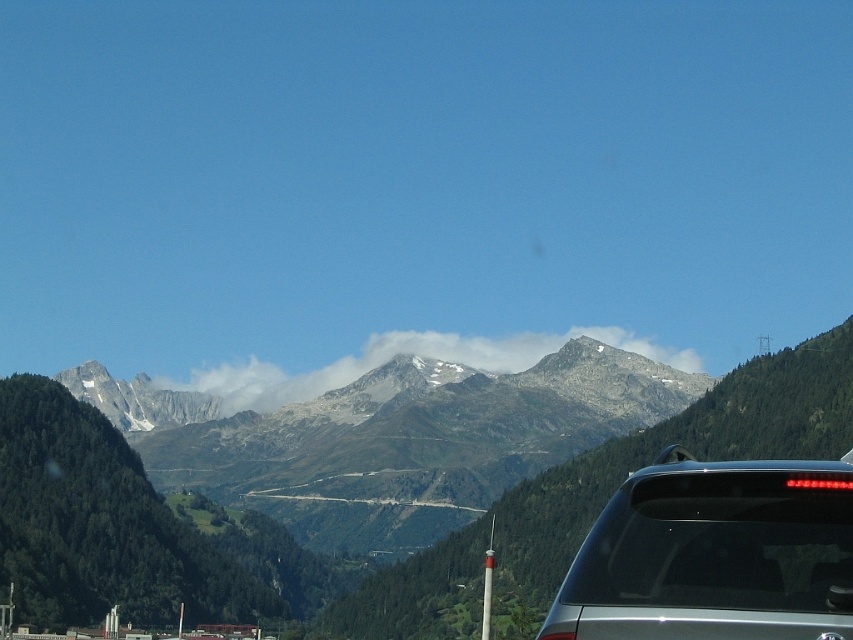
You are a photographer planning to capture a landscape shot of the gray rocky mountain range at center and the white fluffy cloud at center. Which object will appear wider in your photo?

The gray rocky mountain range at center will appear wider in the photo because its width surpasses that of the white fluffy cloud at center.

Based on the scene description and the coordinates provided, what does the point at coordinate (186, 544) represent in the image?

The point at coordinate (186, 544) represents the gray rocky mountain range at center as indicated in the Objects Description.

You are a photographer trying to capture the white fluffy cloud at center and the gray rocky mountain range at center in the same frame. Based on their positions, which one is positioned to the left?

The gray rocky mountain range at center is to the left of the white fluffy cloud at center.